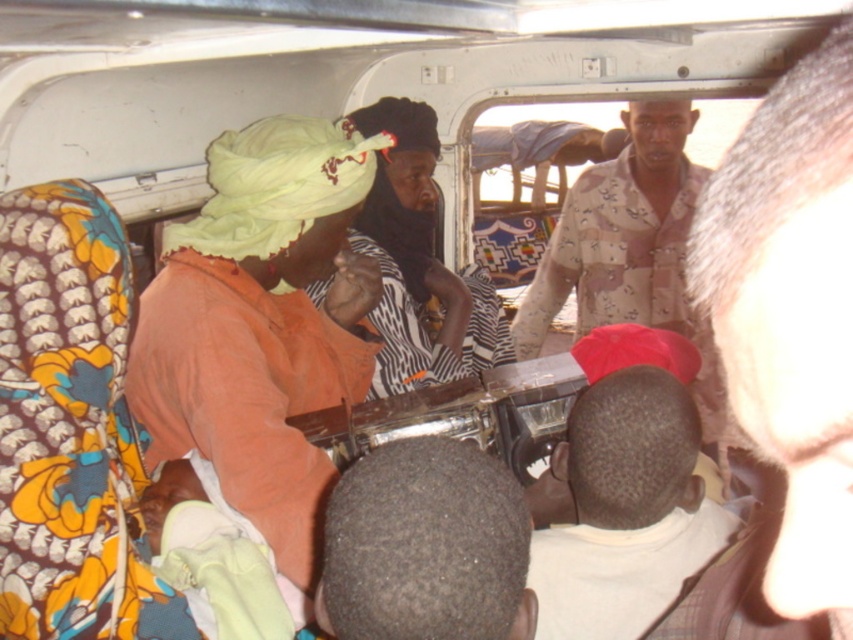
Can you confirm if dark hair at center is smaller than camouflage shirt at center?

Correct, dark hair at center occupies less space than camouflage shirt at center.

Can you confirm if dark hair at center is wider than camouflage shirt at center?

In fact, dark hair at center might be narrower than camouflage shirt at center.

Is point (407, 634) closer to viewer compared to point (618, 220)?

Yes, point (407, 634) is in front of point (618, 220).

Image resolution: width=853 pixels, height=640 pixels. I want to click on dark hair at center, so click(x=426, y=547).

Consider the image. Does matte orange shirt at center appear under white matte shirt at center?

Actually, matte orange shirt at center is above white matte shirt at center.

Between matte orange shirt at center and white matte shirt at center, which one has more height?

Standing taller between the two is matte orange shirt at center.

Measure the distance between matte orange shirt at center and camera.

A distance of 1.48 meters exists between matte orange shirt at center and camera.

Locate an element on the screen. The height and width of the screenshot is (640, 853). matte orange shirt at center is located at coordinates pos(262,323).

What do you see at coordinates (625, 509) in the screenshot?
I see `white matte shirt at center` at bounding box center [625, 509].

Does white matte shirt at center have a greater height compared to dark hair at center?

Yes.

Between point (648, 406) and point (469, 609), which one is positioned in front?

Point (469, 609)

Locate an element on the screen. white matte shirt at center is located at coordinates (625, 509).